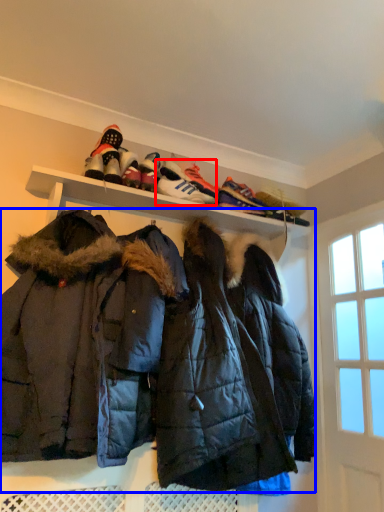
Question: Among these objects, which one is nearest to the camera, footwear (highlighted by a red box) or jacket (highlighted by a blue box)?

Choices:
 (A) footwear
 (B) jacket

Answer: (B)